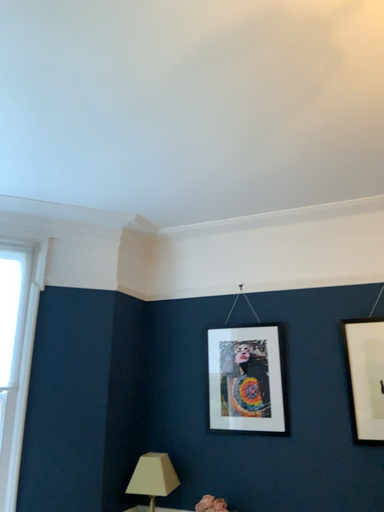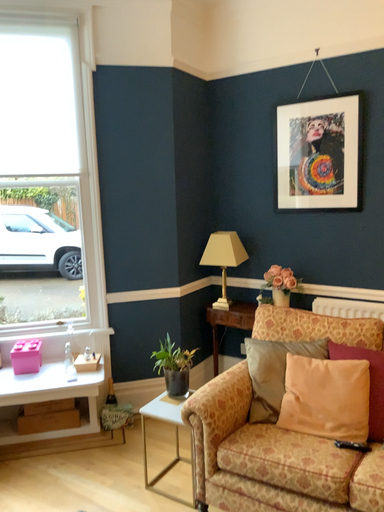
Question: Which way did the camera rotate in the video?

Choices:
 (A) rotated upward
 (B) rotated downward

Answer: (B)